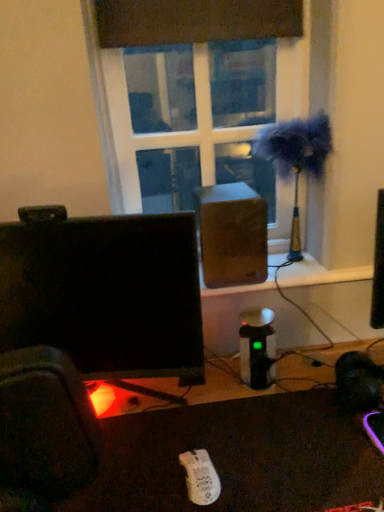
Question: Considering the positions of point click(x=264, y=136) and point click(x=178, y=36), is point click(x=264, y=136) closer or farther from the camera than point click(x=178, y=36)?

Choices:
 (A) closer
 (B) farther

Answer: (B)

Question: From a real-world perspective, is metallic gold table lamp at upper right above or below transparent glass window at center?

Choices:
 (A) above
 (B) below

Answer: (B)

Question: Based on their relative distances, which object is nearer to the black glossy monitor at center?

Choices:
 (A) wooden speaker at center
 (B) white matte wii controller at lower center
 (C) black plastic desk at lower center
 (D) transparent glass window at center
 (E) metallic gold table lamp at upper right

Answer: (A)

Question: Which of these objects is positioned farthest from the metallic gold table lamp at upper right?

Choices:
 (A) black glossy monitor at center
 (B) black plastic desk at lower center
 (C) transparent glass window at center
 (D) wooden speaker at center
 (E) white matte wii controller at lower center

Answer: (E)